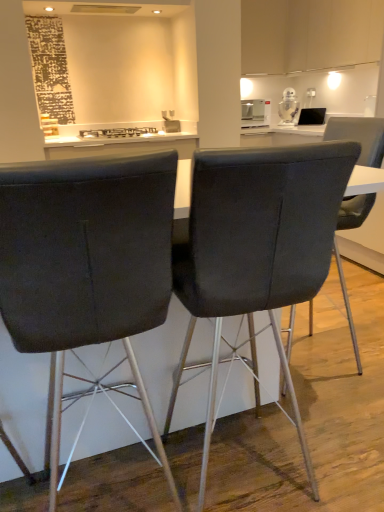
You are a GUI agent. You are given a task and a screenshot of the screen. Output one action in this format:
    pyautogui.click(x=<x>, y=<y>)
    Task: Click on the free point to the right of matte black chair at center, which is the second chair in right-to-left order
    This screenshot has width=384, height=512.
    Given the screenshot: What is the action you would take?
    pyautogui.click(x=340, y=442)